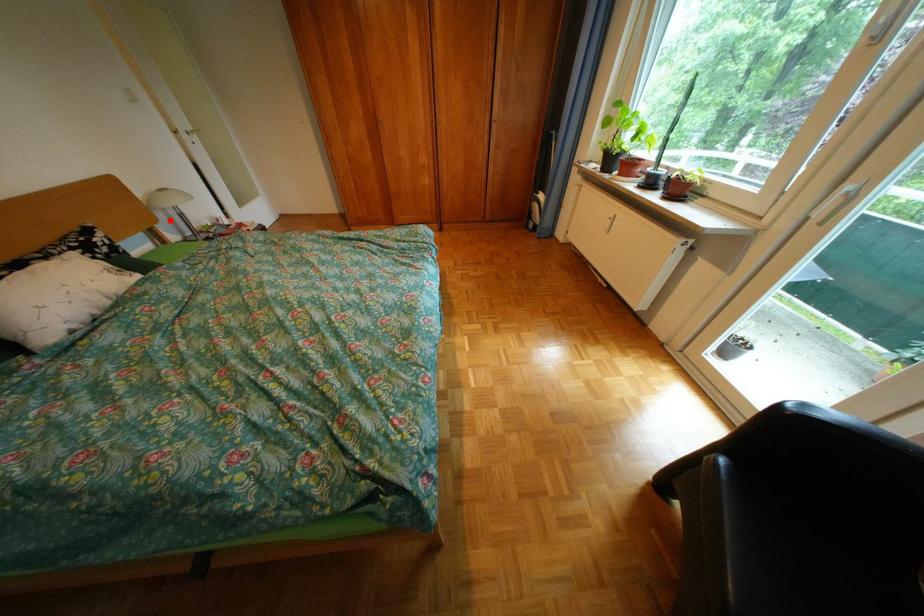
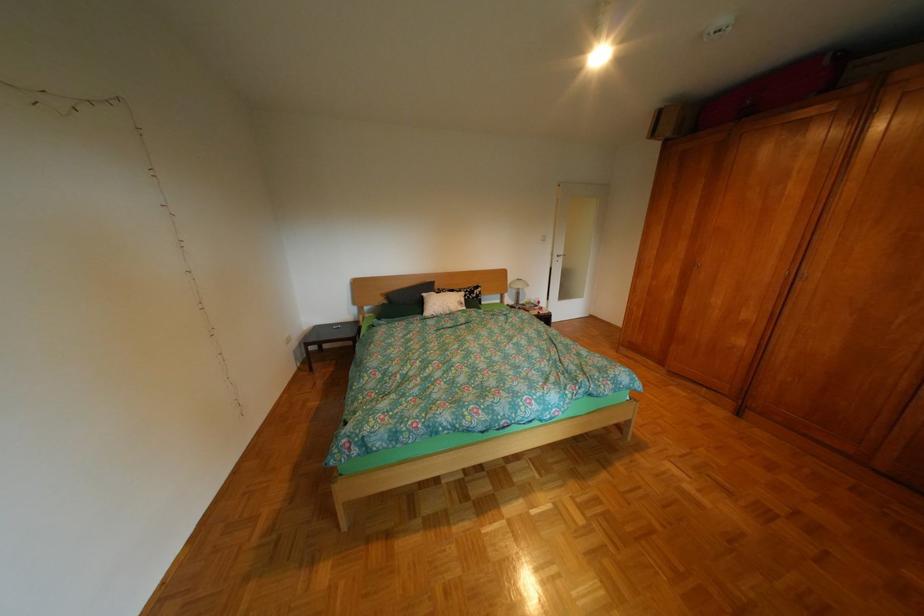
The point at the highlighted location is marked in the first image. Where is the corresponding point in the second image?

(521, 292)